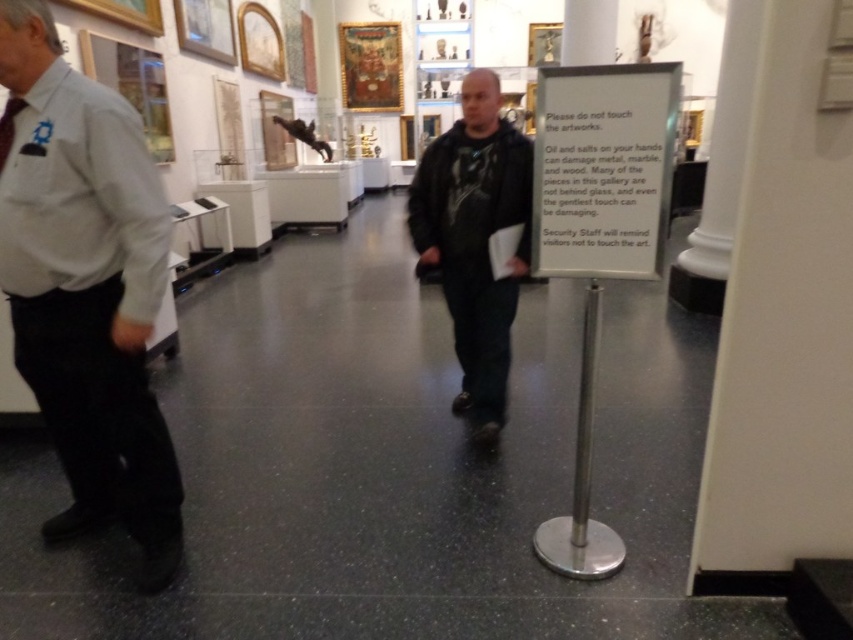
Looking at this image, you are a museum security guard checking the visitors. You see the gray shirt at left and the dark green textured shirt at center. Which visitor has a wider shirt?

The gray shirt at left has a larger width than the dark green textured shirt at center, so the visitor wearing the gray shirt at left has a wider shirt.

What is the 2D coordinate of the gray shirt at left in the museum scene?

The gray shirt at left is located at the 2D coordinate point of (86, 285).

You are standing in the museum and see two points marked in the scene. Which point, point (4, 150) or point (491, 70), is closer to you?

Point (4, 150) is closer to the viewer than point (491, 70).